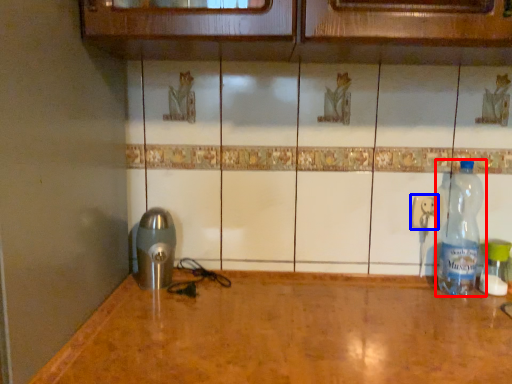
Question: Which object appears farthest to the camera in this image, bottle (highlighted by a red box) or electric outlet (highlighted by a blue box)?

Choices:
 (A) bottle
 (B) electric outlet

Answer: (B)